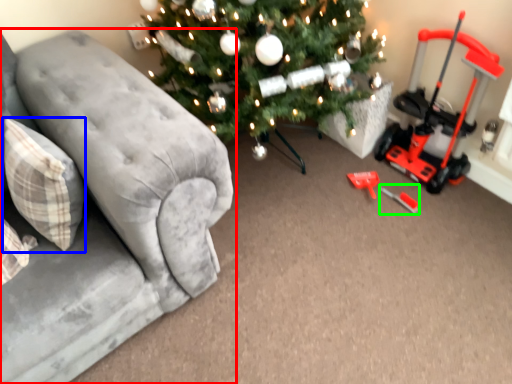
Question: Considering the real-world distances, which object is closest to studio couch (highlighted by a red box)? pillow (highlighted by a blue box) or toy (highlighted by a green box).

Choices:
 (A) pillow
 (B) toy

Answer: (A)